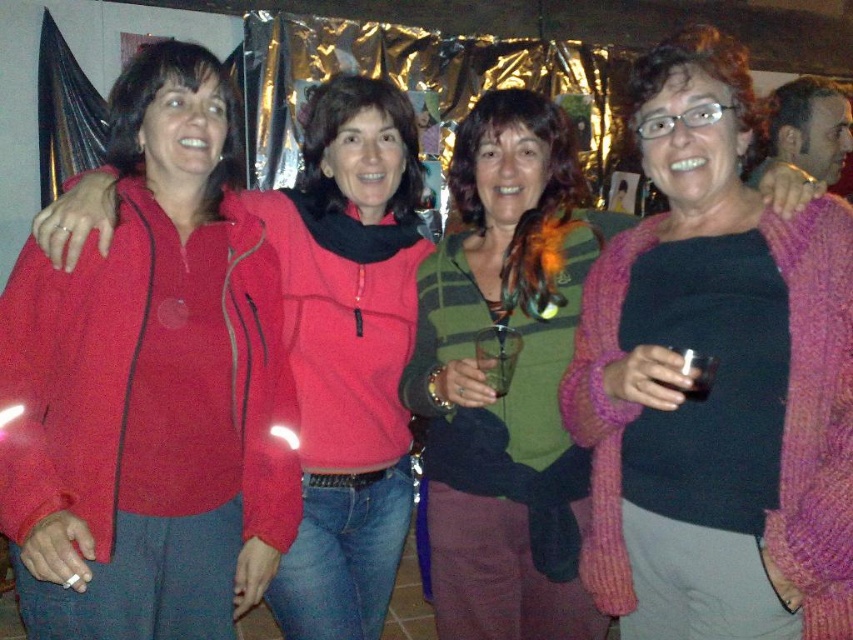
This screenshot has width=853, height=640. I want to click on pink knitted sweater at center, so coord(717,380).

Between point (686, 465) and point (408, 266), which one is positioned in front?

Positioned in front is point (686, 465).

Is point (619, 285) farther from viewer compared to point (281, 214)?

No.

Find the location of a particular element. This screenshot has height=640, width=853. pink knitted sweater at center is located at coordinates (717, 380).